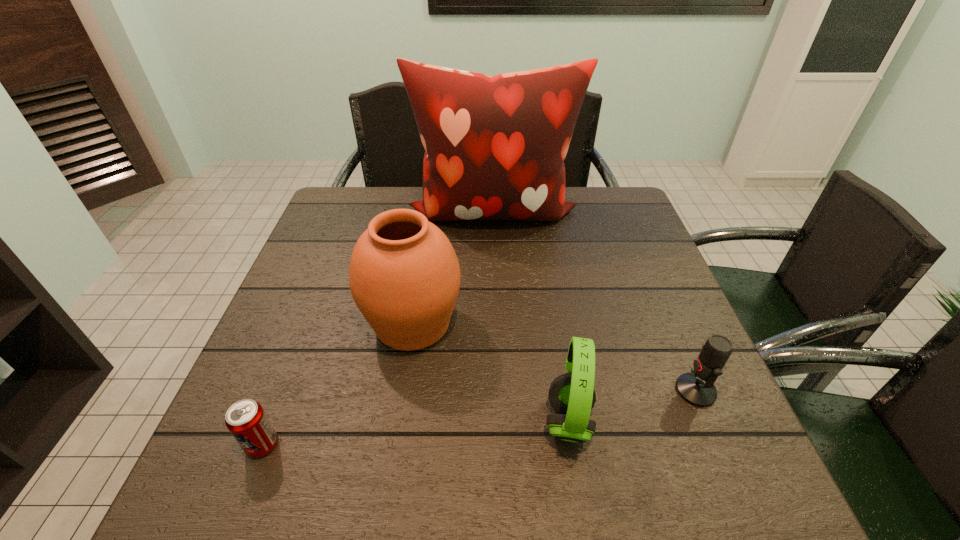
Where is `vacant area between the rightmost object and the tallest object`? The height and width of the screenshot is (540, 960). vacant area between the rightmost object and the tallest object is located at coordinates (593, 301).

Where is `free space between the microphone and the leftmost object`? free space between the microphone and the leftmost object is located at coordinates (479, 417).

Locate an element on the screen. The width and height of the screenshot is (960, 540). free space that is in between the headset and the cushion is located at coordinates (530, 316).

Locate an element on the screen. This screenshot has width=960, height=540. free space that is in between the fourth nearest object and the third shortest object is located at coordinates (491, 373).

Find the location of a particular element. The width and height of the screenshot is (960, 540). vacant point located between the urn and the soda can is located at coordinates (338, 384).

Locate which object ranks third in proximity to the urn. Please provide its 2D coordinates. Your answer should be formatted as a tuple, i.e. [(x, y)], where the tuple contains the x and y coordinates of a point satisfying the conditions above.

[(494, 146)]

Where is `object that can be found as the second closest to the shortest object`? object that can be found as the second closest to the shortest object is located at coordinates (572, 395).

Image resolution: width=960 pixels, height=540 pixels. Identify the location of vacant area that satisfies the following two spatial constraints: 1. on the front-facing side of the headset; 2. on the right side of the farthest object. (499, 421).

Locate an element on the screen. vacant area in the image that satisfies the following two spatial constraints: 1. on the side of the second shortest object with the red ring; 2. on the front side of the third tallest object is located at coordinates click(x=708, y=421).